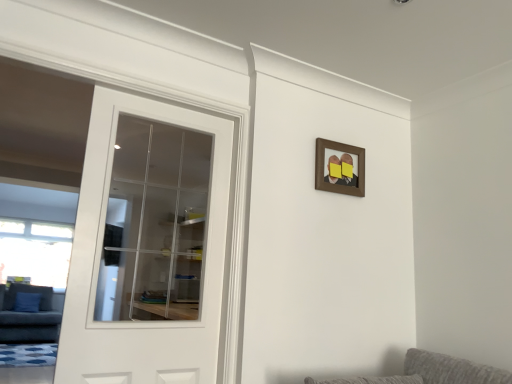
Question: Is brown wooden picture frame at upper center spatially inside white glass door at left, or outside of it?

Choices:
 (A) outside
 (B) inside

Answer: (A)

Question: Based on their sizes in the image, would you say brown wooden picture frame at upper center is bigger or smaller than white glass door at left?

Choices:
 (A) small
 (B) big

Answer: (A)

Question: Which object is positioned closest to the brown wooden picture frame at upper center?

Choices:
 (A) white glass door at left
 (B) dark gray fabric couch at left

Answer: (A)

Question: Which object is the farthest from the white glass door at left?

Choices:
 (A) brown wooden picture frame at upper center
 (B) dark gray fabric couch at left

Answer: (A)